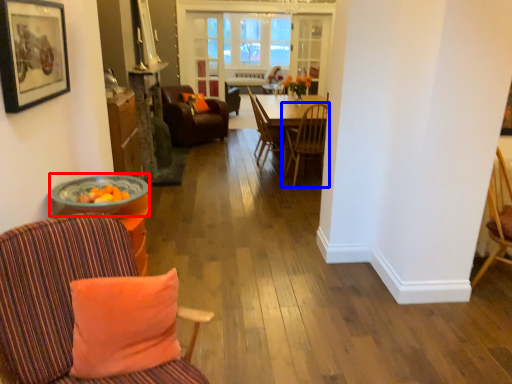
Question: Among these objects, which one is nearest to the camera, round table (highlighted by a red box) or chair (highlighted by a blue box)?

Choices:
 (A) round table
 (B) chair

Answer: (A)